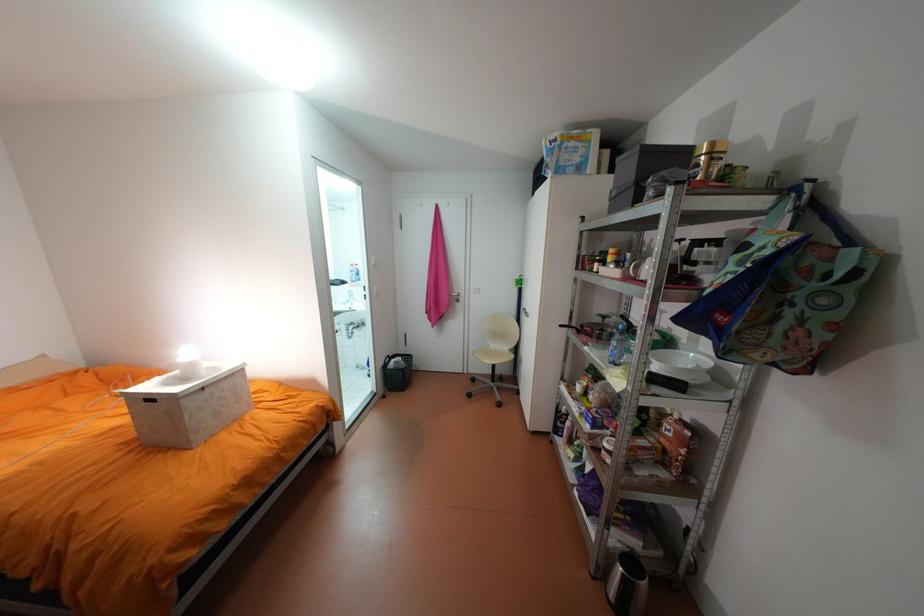
Find where to lift the tote bag handle. Please return your answer as a coordinate pair (x, y).

(807, 201)